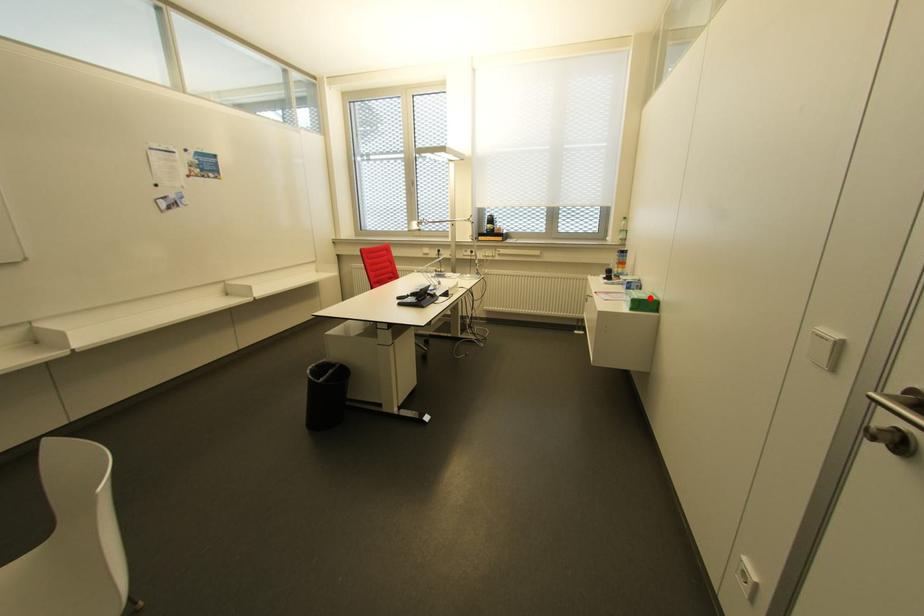
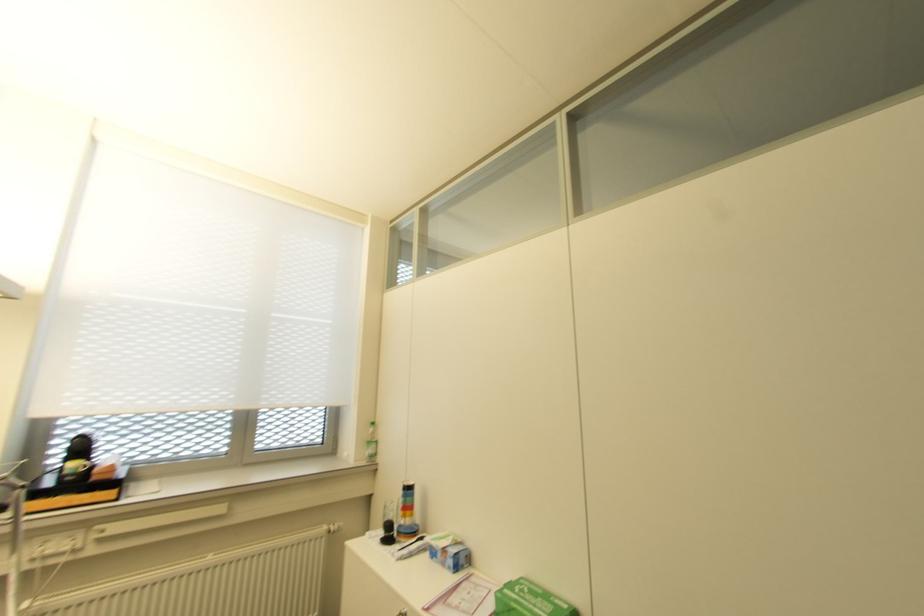
Find the pixel in the second image that matches the highlighted location in the first image.

(563, 605)